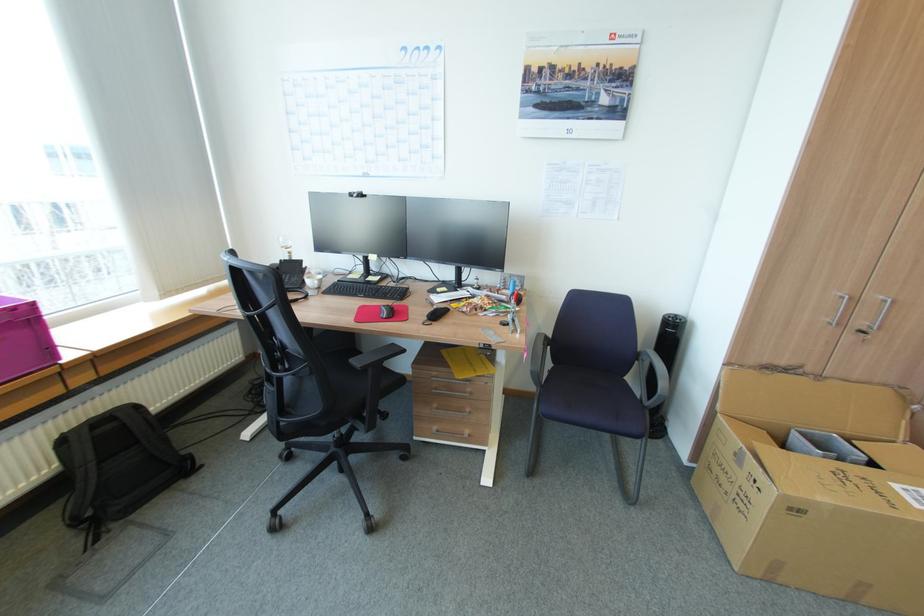
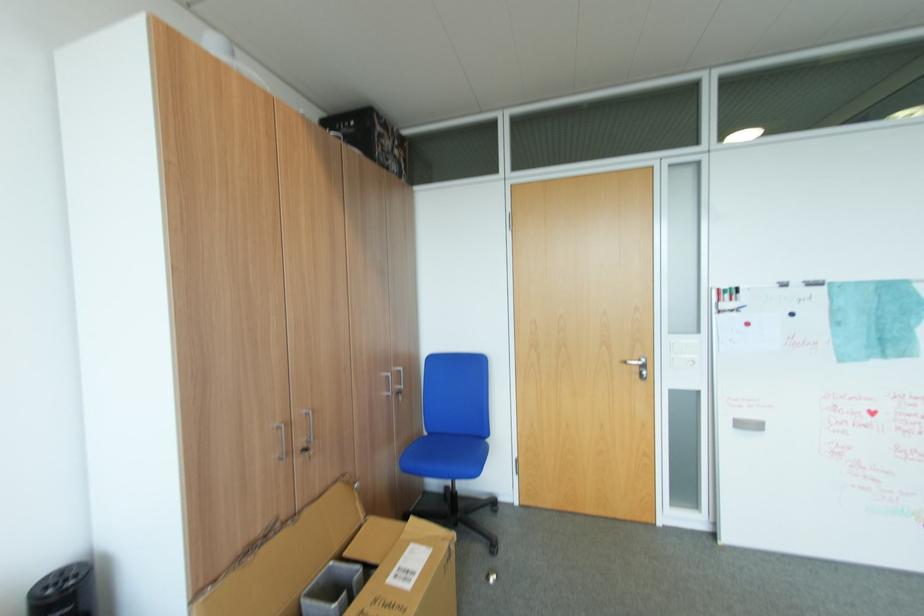
Question: The camera is either moving clockwise (left) or counter-clockwise (right) around the object. The first image is from the beginning of the video and the second image is from the end. Is the camera moving left or right when shooting the video?

Choices:
 (A) Left
 (B) Right

Answer: (A)